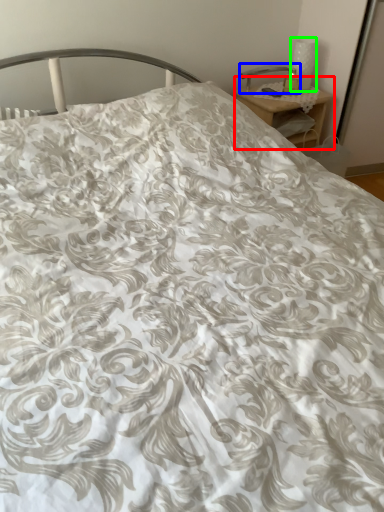
Question: Which object is the farthest from nightstand (highlighted by a red box)? Choose among these: table lamp (highlighted by a blue box) or table lamp (highlighted by a green box).

Choices:
 (A) table lamp
 (B) table lamp

Answer: (B)